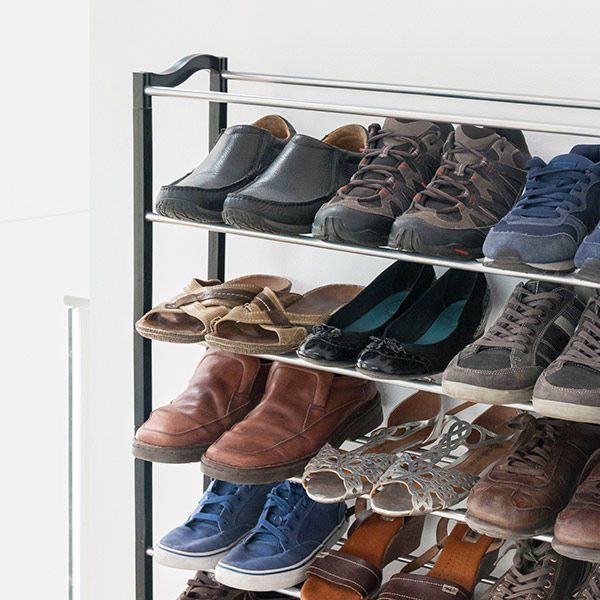
Image resolution: width=600 pixels, height=600 pixels. Find the location of `shows on top shelf`. shows on top shelf is located at coordinates (233, 173), (280, 193), (358, 203), (441, 221), (506, 229), (593, 250).